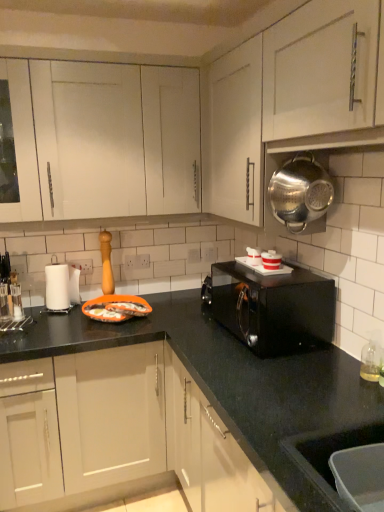
Where is `black matte microwave oven at center`? The height and width of the screenshot is (512, 384). black matte microwave oven at center is located at coordinates (272, 307).

Find the location of a particular element. white plastic container at center, which ranks as the third appliance in bottom-to-top order is located at coordinates (254, 256).

The height and width of the screenshot is (512, 384). Describe the element at coordinates (57, 287) in the screenshot. I see `white paper towel at left, the 1th appliance in the bottom-to-top sequence` at that location.

In order to face white paper towel at left, which ranks as the fourth appliance in right-to-left order, should I rotate leftwards or rightwards?

Rotate left and turn 16.891 degrees.

The image size is (384, 512). What do you see at coordinates (271, 260) in the screenshot?
I see `white glossy microwave at upper right, positioned as the 2th appliance in right-to-left order` at bounding box center [271, 260].

What do you see at coordinates (371, 357) in the screenshot? I see `clear glass bottle at lower right` at bounding box center [371, 357].

Locate an element on the screen. This screenshot has height=512, width=384. black matte microwave oven at center is located at coordinates (272, 307).

In the scene shown: Is black matte microwave oven at center not close to white plastic container at center, the 2th appliance viewed from the back?

black matte microwave oven at center is actually quite close to white plastic container at center, the 2th appliance viewed from the back.

Can you confirm if black matte microwave oven at center is shorter than white plastic container at center, the third appliance from the right?

Incorrect, the height of black matte microwave oven at center does not fall short of that of white plastic container at center, the third appliance from the right.

Is black matte microwave oven at center facing away from white plastic container at center, the third appliance from the right?

That's not correct — black matte microwave oven at center is not looking away from white plastic container at center, the third appliance from the right.

Based on the photo, measure the distance between black matte microwave oven at center and white plastic container at center, marked as the second appliance in a left-to-right arrangement.

black matte microwave oven at center is 12.53 inches away from white plastic container at center, marked as the second appliance in a left-to-right arrangement.

Does matte white cabinets at center, arranged as the 1th cabinetry when ordered from the bottom, have a greater width compared to white paper towel at left, acting as the 4th appliance starting from the front?

Indeed, matte white cabinets at center, arranged as the 1th cabinetry when ordered from the bottom, has a greater width compared to white paper towel at left, acting as the 4th appliance starting from the front.

How much distance is there between matte white cabinets at center, arranged as the 1th cabinetry when ordered from the bottom, and white paper towel at left, which is counted as the 1th appliance, starting from the left?

matte white cabinets at center, arranged as the 1th cabinetry when ordered from the bottom, is 26.17 inches from white paper towel at left, which is counted as the 1th appliance, starting from the left.

Consider the image. Is matte white cabinets at center, the second cabinetry viewed from the top, shorter than white paper towel at left, acting as the 4th appliance starting from the front?

No, matte white cabinets at center, the second cabinetry viewed from the top, is not shorter than white paper towel at left, acting as the 4th appliance starting from the front.

Is matte white cabinets at center, arranged as the 1th cabinetry when ordered from the bottom, not near white paper towel at left, which ranks as the fourth appliance in right-to-left order?

matte white cabinets at center, arranged as the 1th cabinetry when ordered from the bottom, is actually quite close to white paper towel at left, which ranks as the fourth appliance in right-to-left order.

From a real-world perspective, is white paper towel at left, which ranks as the fourth appliance in right-to-left order, positioned above or below matte white cabinets at center, arranged as the 1th cabinetry when ordered from the bottom?

white paper towel at left, which ranks as the fourth appliance in right-to-left order, is situated higher than matte white cabinets at center, arranged as the 1th cabinetry when ordered from the bottom, in the real world.

Is white paper towel at left, which is counted as the 1th appliance, starting from the left, positioned before matte white cabinets at center, the second cabinetry viewed from the top?

No, white paper towel at left, which is counted as the 1th appliance, starting from the left, is further to the viewer.

Is point (49, 307) closer to camera compared to point (128, 407)?

No, (49, 307) is behind (128, 407).

Is white plastic container at center, the 2th appliance viewed from the back, facing towards black matte microwave oven at center?

No, white plastic container at center, the 2th appliance viewed from the back, is not turned towards black matte microwave oven at center.

Would you consider white plastic container at center, which ranks as the third appliance in bottom-to-top order, to be distant from black matte microwave oven at center?

white plastic container at center, which ranks as the third appliance in bottom-to-top order, is near black matte microwave oven at center, not far away.

From a real-world perspective, is white plastic container at center, marked as the second appliance in a left-to-right arrangement, on black matte microwave oven at center?

Indeed, from a real-world perspective, white plastic container at center, marked as the second appliance in a left-to-right arrangement, stands above black matte microwave oven at center.

From the image's perspective, who appears lower, white plastic container at center, marked as the second appliance in a left-to-right arrangement, or black matte microwave oven at center?

black matte microwave oven at center is shown below in the image.

From the image's perspective, is white glossy microwave at upper right, positioned as the 2th appliance in right-to-left order, below white paper towel at left, which ranks as the fourth appliance in right-to-left order?

No, from the image's perspective, white glossy microwave at upper right, positioned as the 2th appliance in right-to-left order, is not below white paper towel at left, which ranks as the fourth appliance in right-to-left order.

How different are the orientations of white glossy microwave at upper right, the 2th appliance viewed from the front, and white paper towel at left, which is the 1th appliance in back-to-front order, in degrees?

There is a 90.4-degree angle between the facing directions of white glossy microwave at upper right, the 2th appliance viewed from the front, and white paper towel at left, which is the 1th appliance in back-to-front order.

Can you confirm if white glossy microwave at upper right, the second appliance from the bottom, is shorter than white paper towel at left, which is the fourth appliance in top-to-bottom order?

Yes, white glossy microwave at upper right, the second appliance from the bottom, is shorter than white paper towel at left, which is the fourth appliance in top-to-bottom order.

Can we say metallic silver pot at upper right, marked as the 1th cabinetry in a top-to-bottom arrangement, lies outside clear glass bottle at lower right?

Yes, metallic silver pot at upper right, marked as the 1th cabinetry in a top-to-bottom arrangement, is outside of clear glass bottle at lower right.

At what (x,y) coordinates should I click in order to perform the action: click on cabinetry that is above the clear glass bottle at lower right (from a real-world perspective). Please return your answer as a coordinate pair (x, y). This screenshot has height=512, width=384. Looking at the image, I should click on (284, 96).

Are metallic silver pot at upper right, marked as the 1th cabinetry in a top-to-bottom arrangement, and clear glass bottle at lower right making contact?

No, metallic silver pot at upper right, marked as the 1th cabinetry in a top-to-bottom arrangement, is not beside clear glass bottle at lower right.

Can you confirm if metallic silver pot at upper right, marked as the 1th cabinetry in a top-to-bottom arrangement, is thinner than clear glass bottle at lower right?

In fact, metallic silver pot at upper right, marked as the 1th cabinetry in a top-to-bottom arrangement, might be wider than clear glass bottle at lower right.

Is white plastic container at center, the 2th appliance viewed from the back, at the right side of metallic silver pot at upper right, marked as the 1th cabinetry in a top-to-bottom arrangement?

Correct, you'll find white plastic container at center, the 2th appliance viewed from the back, to the right of metallic silver pot at upper right, marked as the 1th cabinetry in a top-to-bottom arrangement.

Is white plastic container at center, the 2th appliance viewed from the back, shorter than metallic silver pot at upper right, marked as the 1th cabinetry in a top-to-bottom arrangement?

Correct, white plastic container at center, the 2th appliance viewed from the back, is not as tall as metallic silver pot at upper right, marked as the 1th cabinetry in a top-to-bottom arrangement.

Who is bigger, white plastic container at center, the third appliance from the right, or metallic silver pot at upper right, marked as the 1th cabinetry in a top-to-bottom arrangement?

metallic silver pot at upper right, marked as the 1th cabinetry in a top-to-bottom arrangement.

Considering the sizes of white plastic container at center, the 2th appliance viewed from the back, and metallic silver pot at upper right, marked as the 1th cabinetry in a top-to-bottom arrangement, in the image, is white plastic container at center, the 2th appliance viewed from the back, wider or thinner than metallic silver pot at upper right, marked as the 1th cabinetry in a top-to-bottom arrangement,?

In the image, white plastic container at center, the 2th appliance viewed from the back, appears to be more narrow than metallic silver pot at upper right, marked as the 1th cabinetry in a top-to-bottom arrangement.

This screenshot has width=384, height=512. Identify the location of microwave oven that is below the white plastic container at center, which is the 2th appliance from top to bottom (from the image's perspective). (272, 307).

At what (x,y) coordinates should I click in order to perform the action: click on cabinetry beneath the white paper towel at left, which is counted as the 1th appliance, starting from the left (from a real-world perspective). Please return your answer as a coordinate pair (x, y). Looking at the image, I should click on (146, 430).

Estimate the real-world distances between objects in this image. Which object is further from matte white cabinets at center, arranged as the 1th cabinetry when ordered from the bottom, metallic silver strainer at upper right, which ranks as the first appliance in top-to-bottom order, or white glossy microwave at upper right, marked as the third appliance in a top-to-bottom arrangement?

metallic silver strainer at upper right, which ranks as the first appliance in top-to-bottom order.

Looking at the image, which one is located closer to metallic silver strainer at upper right, the fourth appliance ordered from the bottom, matte white cabinets at center, arranged as the 1th cabinetry when ordered from the bottom, or white plastic container at center, which ranks as the third appliance in bottom-to-top order?

Based on the image, white plastic container at center, which ranks as the third appliance in bottom-to-top order, appears to be nearer to metallic silver strainer at upper right, the fourth appliance ordered from the bottom.

Based on their spatial positions, is white glossy microwave at upper right, the second appliance from the bottom, or white plastic container at center, the third appliance from the right, further from clear glass bottle at lower right?

Based on the image, white plastic container at center, the third appliance from the right, appears to be further to clear glass bottle at lower right.

Which object lies nearer to the anchor point metallic silver pot at upper right, which is counted as the 2th cabinetry, starting from the bottom, white plastic container at center, the 3th appliance when ordered from front to back, or white glossy microwave at upper right, the second appliance from the bottom?

white glossy microwave at upper right, the second appliance from the bottom, is closer to metallic silver pot at upper right, which is counted as the 2th cabinetry, starting from the bottom.

From the image, which object appears to be farther from white plastic container at center, the 3th appliance when ordered from front to back, white glossy microwave at upper right, positioned as the 2th appliance in right-to-left order, or clear glass bottle at lower right?

The object further to white plastic container at center, the 3th appliance when ordered from front to back, is clear glass bottle at lower right.

From the image, which object appears to be nearer to white paper towel at left, which is the 1th appliance in back-to-front order, white glossy microwave at upper right, positioned as the 2th appliance in right-to-left order, or white plastic container at center, marked as the second appliance in a left-to-right arrangement?

The object closer to white paper towel at left, which is the 1th appliance in back-to-front order, is white plastic container at center, marked as the second appliance in a left-to-right arrangement.

When comparing their distances from white paper towel at left, which is the 1th appliance in back-to-front order, does white plastic container at center, the 2th appliance viewed from the back, or metallic silver strainer at upper right, the fourth appliance from the back, seem further?

Among the two, metallic silver strainer at upper right, the fourth appliance from the back, is located further to white paper towel at left, which is the 1th appliance in back-to-front order.

Estimate the real-world distances between objects in this image. Which object is closer to white plastic container at center, marked as the second appliance in a left-to-right arrangement, metallic silver strainer at upper right, the fourth appliance from the back, or metallic silver pot at upper right, which is counted as the 2th cabinetry, starting from the bottom?

The object closer to white plastic container at center, marked as the second appliance in a left-to-right arrangement, is metallic silver strainer at upper right, the fourth appliance from the back.

Where is `microwave oven between matte white cabinets at center, the second cabinetry viewed from the top, and clear glass bottle at lower right from left to right`? This screenshot has height=512, width=384. microwave oven between matte white cabinets at center, the second cabinetry viewed from the top, and clear glass bottle at lower right from left to right is located at coordinates (272, 307).

The image size is (384, 512). What are the coordinates of `bottle between metallic silver pot at upper right, which is counted as the 2th cabinetry, starting from the bottom, and matte white cabinets at center, arranged as the 1th cabinetry when ordered from the bottom, from top to bottom` in the screenshot? It's located at (371, 357).

Locate an element on the screen. This screenshot has height=512, width=384. microwave oven located between white paper towel at left, which ranks as the fourth appliance in right-to-left order, and white glossy microwave at upper right, marked as the third appliance in a top-to-bottom arrangement, in the left-right direction is located at coordinates (272, 307).

You are a GUI agent. You are given a task and a screenshot of the screen. Output one action in this format:
    pyautogui.click(x=<x>, y=<y>)
    Task: Click on the microwave oven between metallic silver pot at upper right, marked as the 1th cabinetry in a top-to-bottom arrangement, and matte white cabinets at center, arranged as the 1th cabinetry when ordered from the bottom, vertically
    
    Given the screenshot: What is the action you would take?
    coord(272,307)